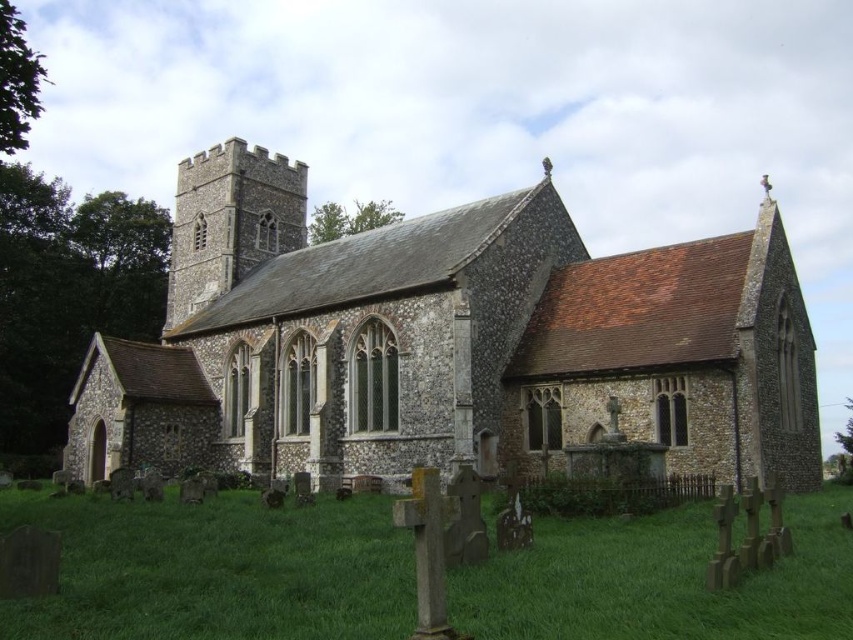
You are a landscape architect planning to install a new garden bed between the stone church at center and the green grass at lower center. Given the spatial relationship between these two elements, which one would require more space to accommodate the garden bed?

The stone church at center has a larger width than the green grass at lower center, so the garden bed would require more space near the stone church at center.

You are standing in front of the stone church at center and looking towards the green grass at lower center. Which object is larger in size?

The stone church at center is bigger than the green grass at lower center.

You are standing at point (445, 342) in the image. What is the object located at this point?

The stone church at center is located at point (445, 342).